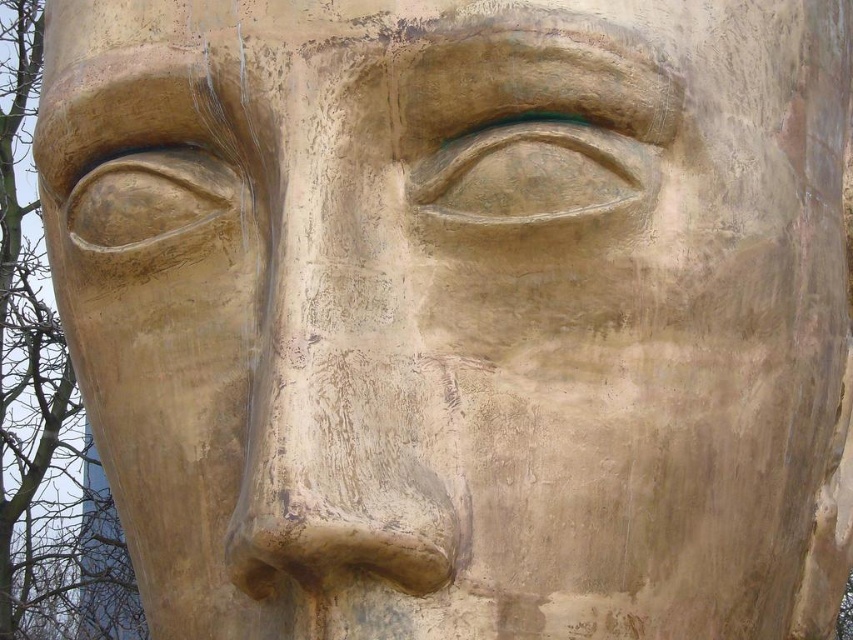
Is matte gold nose at center positioned at the back of matte gold eye at center?

No, it is in front of matte gold eye at center.

Is matte gold nose at center smaller than matte gold eye at center?

No.

Identify the location of matte gold nose at center. (338, 477).